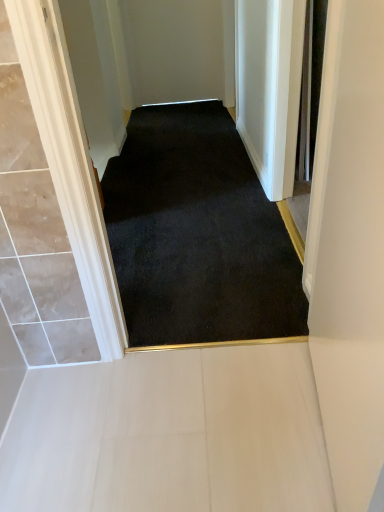
Question: Can white tile floor at lower center be found inside matte white door at right?

Choices:
 (A) no
 (B) yes

Answer: (A)

Question: Is matte white door at right taller than white tile floor at lower center?

Choices:
 (A) yes
 (B) no

Answer: (A)

Question: Does matte white door at right lie behind white tile floor at lower center?

Choices:
 (A) yes
 (B) no

Answer: (B)

Question: From a real-world perspective, does matte white door at right stand above white tile floor at lower center?

Choices:
 (A) no
 (B) yes

Answer: (B)

Question: Can you confirm if matte white door at right is bigger than white tile floor at lower center?

Choices:
 (A) no
 (B) yes

Answer: (B)

Question: Considering the positions of point (286, 485) and point (271, 275), is point (286, 485) closer or farther from the camera than point (271, 275)?

Choices:
 (A) farther
 (B) closer

Answer: (B)

Question: From a real-world perspective, relative to black carpet at center, is white tile floor at lower center vertically above or below?

Choices:
 (A) below
 (B) above

Answer: (A)

Question: Looking at their shapes, would you say white tile floor at lower center is wider or thinner than black carpet at center?

Choices:
 (A) wide
 (B) thin

Answer: (B)

Question: Considering the positions of white tile floor at lower center and black carpet at center in the image, is white tile floor at lower center taller or shorter than black carpet at center?

Choices:
 (A) tall
 (B) short

Answer: (B)

Question: Is black carpet at center taller or shorter than white tile floor at lower center?

Choices:
 (A) tall
 (B) short

Answer: (A)

Question: Considering the positions of point (132, 290) and point (264, 410), is point (132, 290) closer or farther from the camera than point (264, 410)?

Choices:
 (A) closer
 (B) farther

Answer: (B)

Question: From a real-world perspective, is black carpet at center above or below white tile floor at lower center?

Choices:
 (A) above
 (B) below

Answer: (A)

Question: From the image's perspective, is black carpet at center above or below white tile floor at lower center?

Choices:
 (A) below
 (B) above

Answer: (B)

Question: Considering the positions of matte white door at right and black carpet at center in the image, is matte white door at right taller or shorter than black carpet at center?

Choices:
 (A) tall
 (B) short

Answer: (A)

Question: Does point (360, 465) appear closer or farther from the camera than point (231, 333)?

Choices:
 (A) farther
 (B) closer

Answer: (B)